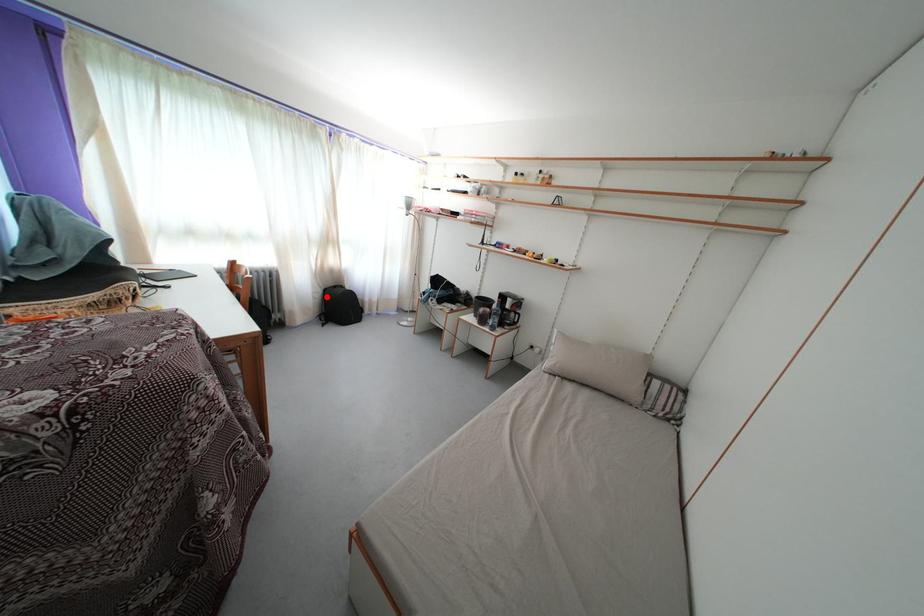
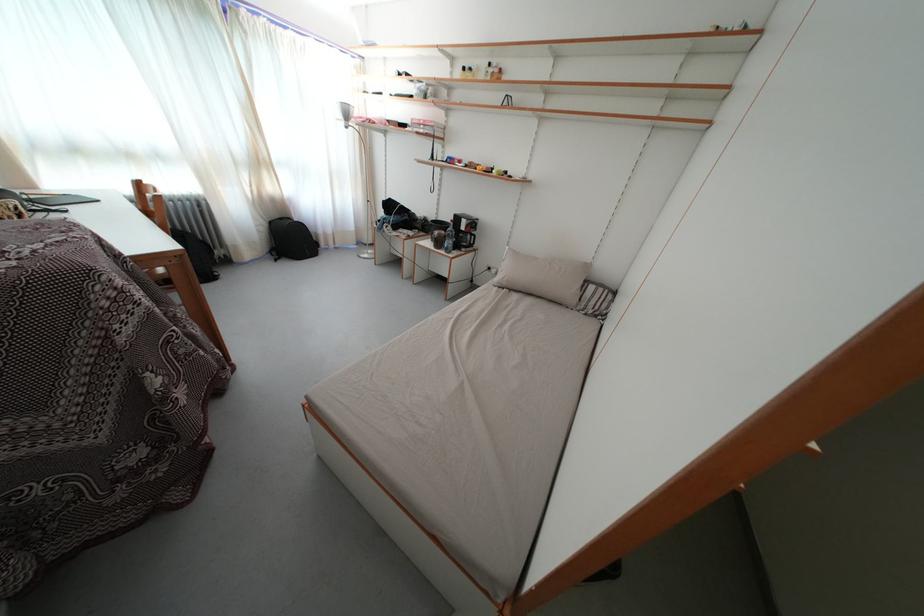
In the second image, find the point that corresponds to the highlighted location in the first image.

(272, 230)